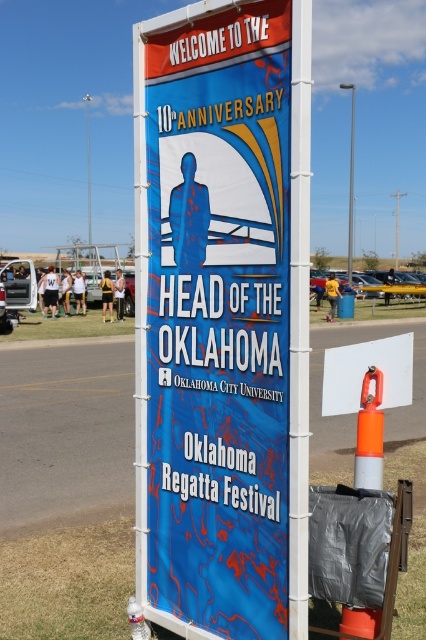
You are an event organizer checking the setup. You need to ensure that the blue vinyl banner at center is securely attached to the metallic pole at center. Given their sizes, which one is narrower?

The blue vinyl banner at center is narrower than the metallic pole at center.

You are a participant in the Oklahoma Regatta Festival and need to locate the registration desk. You see the blue vinyl banner at center and the orange reflective traffic cone at lower right. According to the scene, which object is positioned to the left of the other?

The blue vinyl banner at center is to the left of orange reflective traffic cone at lower right.

What is the relationship in size between the blue vinyl banner at center and the orange reflective traffic cone at lower right?

The blue vinyl banner at center is larger in size than the orange reflective traffic cone at lower right.